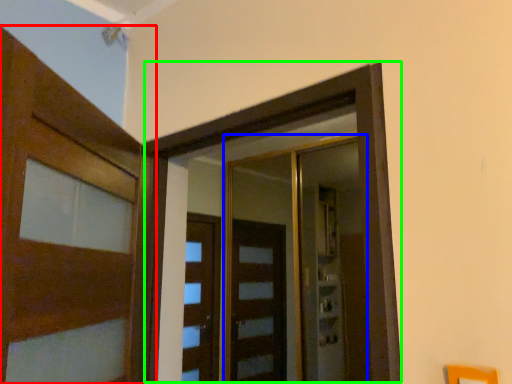
Question: Estimate the real-world distances between objects in this image. Which object is closer to door (highlighted by a red box), elevator (highlighted by a blue box) or elevator (highlighted by a green box)?

Choices:
 (A) elevator
 (B) elevator

Answer: (B)